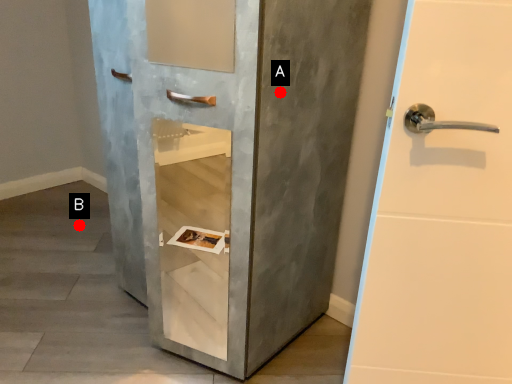
Question: Two points are circled on the image, labeled by A and B beside each circle. Which point is farther from the camera taking this photo?

Choices:
 (A) A is further
 (B) B is further

Answer: (B)